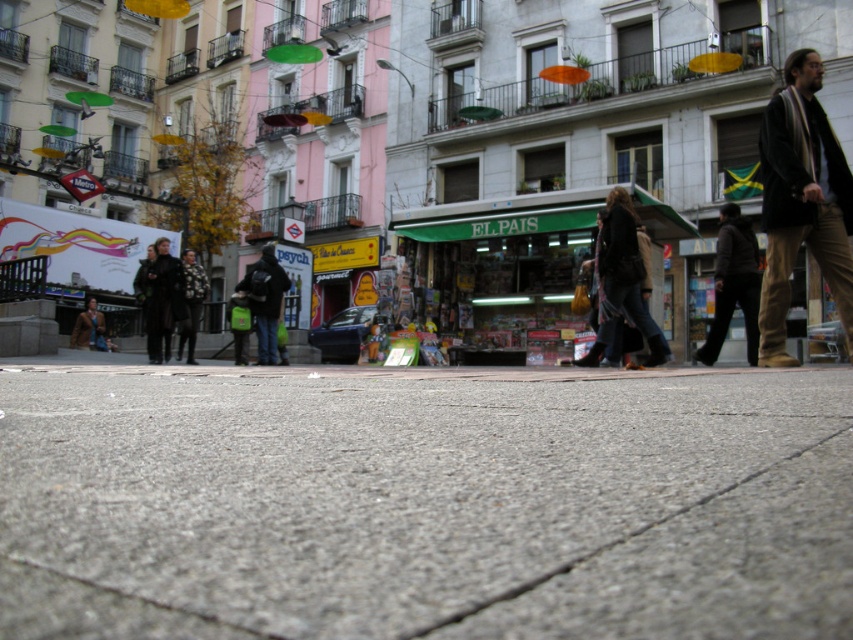
Does point (750, 237) come closer to viewer compared to point (206, 284)?

Yes, point (750, 237) is closer to viewer.

Where is `dark gray jacket at center`? dark gray jacket at center is located at coordinates (733, 284).

Find the location of a particular element. dark gray jacket at center is located at coordinates (733, 284).

From the picture: Can you confirm if green fabric store at center is bigger than dark brown leather jacket at left?

Yes.

From the picture: Which is below, green fabric store at center or dark brown leather jacket at left?

dark brown leather jacket at left is below.

Is point (471, 300) more distant than point (152, 332)?

Yes, point (471, 300) is behind point (152, 332).

At what (x,y) coordinates should I click in order to perform the action: click on green fabric store at center. Please return your answer as a coordinate pair (x, y). Looking at the image, I should click on (502, 268).

Who is taller, brown woolen jacket at right or dark brown leather jacket at center?

brown woolen jacket at right

Does brown woolen jacket at right appear under dark brown leather jacket at center?

Actually, brown woolen jacket at right is above dark brown leather jacket at center.

Based on the photo, measure the distance between brown woolen jacket at right and camera.

brown woolen jacket at right and camera are 5.10 meters apart.

Locate an element on the screen. The height and width of the screenshot is (640, 853). brown woolen jacket at right is located at coordinates (801, 202).